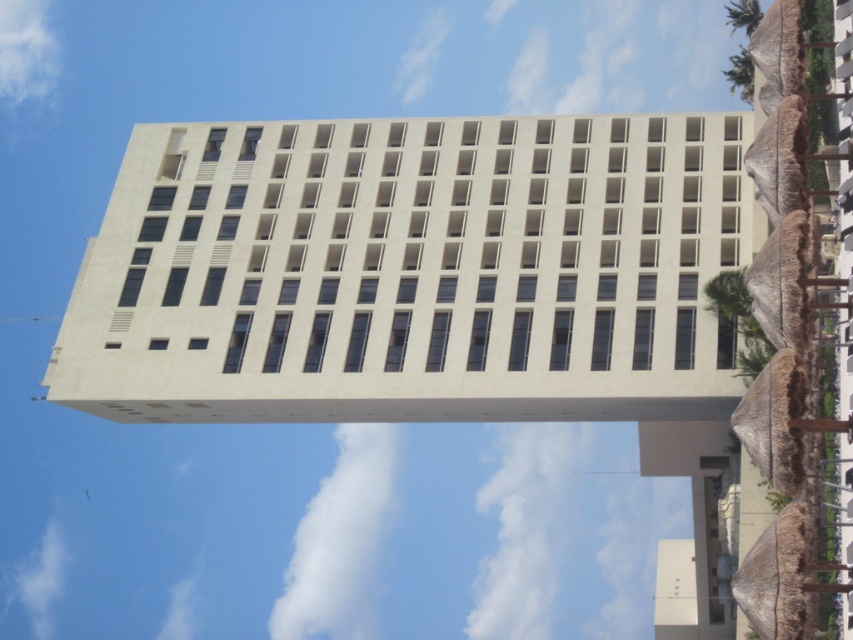
Between green leafy palm tree at right and green leafy palm tree at upper right, which one appears on the left side from the viewer's perspective?

green leafy palm tree at right

Is point (728, 285) positioned before point (730, 77)?

That is True.

Who is more distant from viewer, (x=711, y=291) or (x=746, y=68)?

Positioned behind is point (x=746, y=68).

You are a GUI agent. You are given a task and a screenshot of the screen. Output one action in this format:
    pyautogui.click(x=<x>, y=<y>)
    Task: Click on the green leafy palm tree at right
    
    Given the screenshot: What is the action you would take?
    pyautogui.click(x=730, y=300)

Does point (164, 212) lie behind point (374, 493)?

That is False.

Is beige concrete building at center bigger than white fluffy cloud at upper center?

Yes, beige concrete building at center is bigger than white fluffy cloud at upper center.

Who is more forward, (548, 240) or (383, 436)?

Point (548, 240) is more forward.

Locate an element on the screen. beige concrete building at center is located at coordinates (410, 273).

Between point (61, 595) and point (744, 65), which one is positioned behind?

Point (61, 595)

Can you confirm if white fluffy cloud at lower left is smaller than green leafy palm tree at upper right?

Correct, white fluffy cloud at lower left occupies less space than green leafy palm tree at upper right.

What do you see at coordinates (39, 580) in the screenshot? I see `white fluffy cloud at lower left` at bounding box center [39, 580].

You are a GUI agent. You are given a task and a screenshot of the screen. Output one action in this format:
    pyautogui.click(x=<x>, y=<y>)
    Task: Click on the white fluffy cloud at lower left
    Image resolution: width=853 pixels, height=640 pixels.
    Given the screenshot: What is the action you would take?
    pyautogui.click(x=39, y=580)